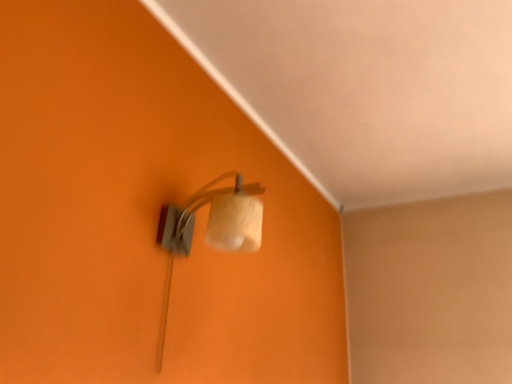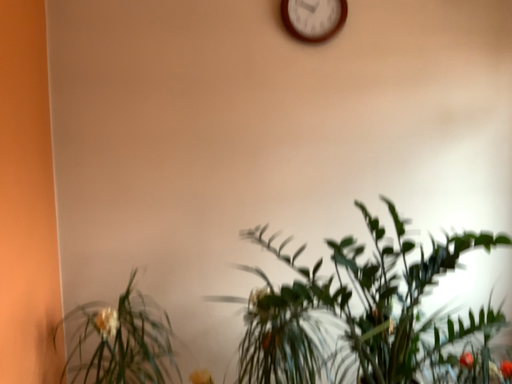
Question: How did the camera likely rotate when shooting the video?

Choices:
 (A) rotated left
 (B) rotated right

Answer: (B)